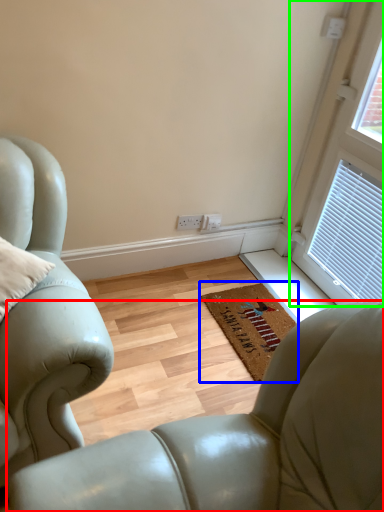
Question: Which is farther away from chair (highlighted by a red box)? mat (highlighted by a blue box) or window (highlighted by a green box)?

Choices:
 (A) mat
 (B) window

Answer: (B)